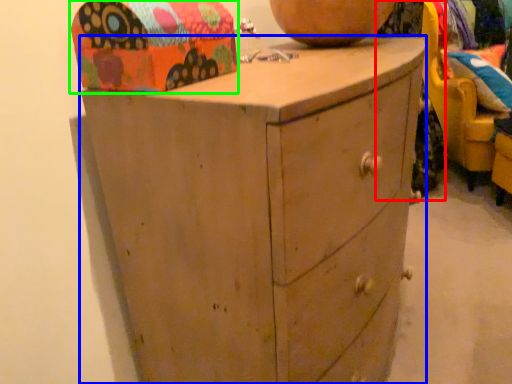
Question: Based on their relative distances, which object is nearer to clothing (highlighted by a red box)? Choose from chest of drawers (highlighted by a blue box) and shoe box (highlighted by a green box).

Choices:
 (A) chest of drawers
 (B) shoe box

Answer: (A)